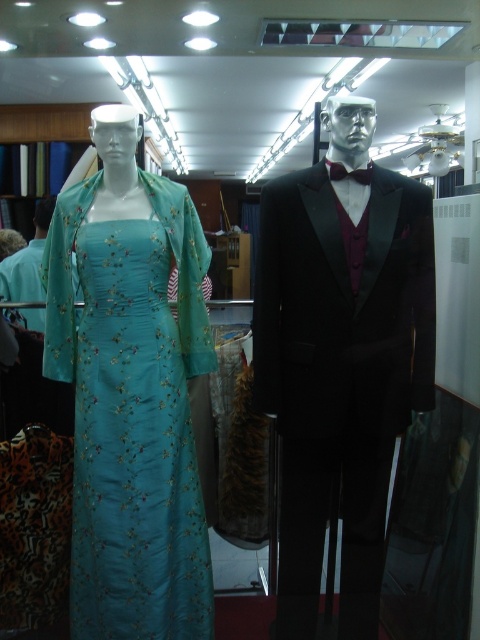
Can you confirm if shiny black suit at center is bigger than teal silk dress at left?

Correct, shiny black suit at center is larger in size than teal silk dress at left.

Between point (316, 323) and point (57, 355), which one is positioned in front?

Point (316, 323) is more forward.

Where is `shiny black suit at center`? The height and width of the screenshot is (640, 480). shiny black suit at center is located at coordinates (340, 356).

Who is more distant from viewer, (164, 272) or (369, 168)?

The point (164, 272) is behind.

Does teal silk dress at left appear on the left side of dark purple satin bow tie at center?

Indeed, teal silk dress at left is positioned on the left side of dark purple satin bow tie at center.

Who is more forward, (128, 195) or (350, 170)?

Point (350, 170) is more forward.

The height and width of the screenshot is (640, 480). Find the location of `teal silk dress at left`. teal silk dress at left is located at coordinates (131, 394).

Does shiny black suit at center have a lesser height compared to dark purple satin bow tie at center?

In fact, shiny black suit at center may be taller than dark purple satin bow tie at center.

Is shiny black suit at center to the left of dark purple satin bow tie at center from the viewer's perspective?

Indeed, shiny black suit at center is positioned on the left side of dark purple satin bow tie at center.

Which is behind, point (328, 212) or point (358, 177)?

The point (358, 177) is behind.

Where is `shiny black suit at center`? This screenshot has height=640, width=480. shiny black suit at center is located at coordinates tap(340, 356).